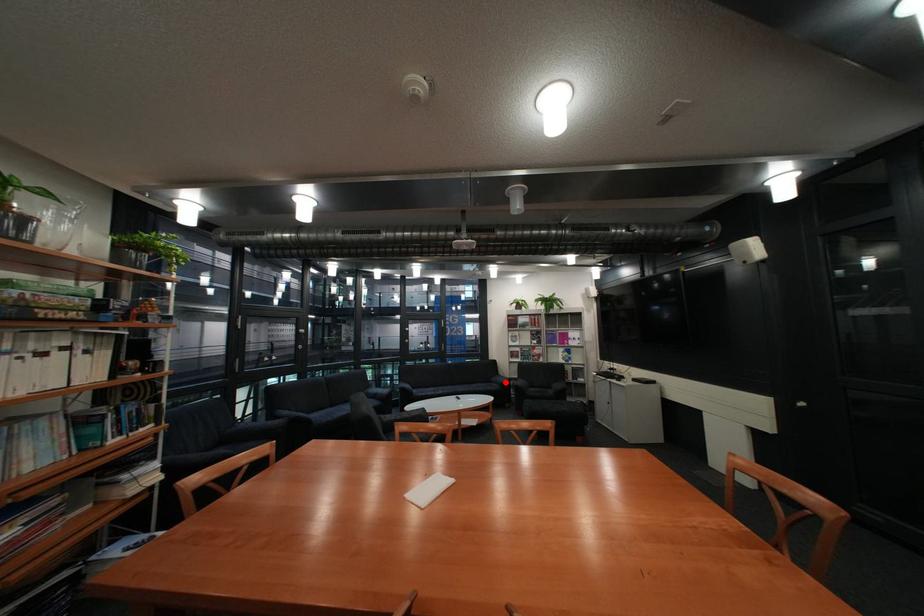
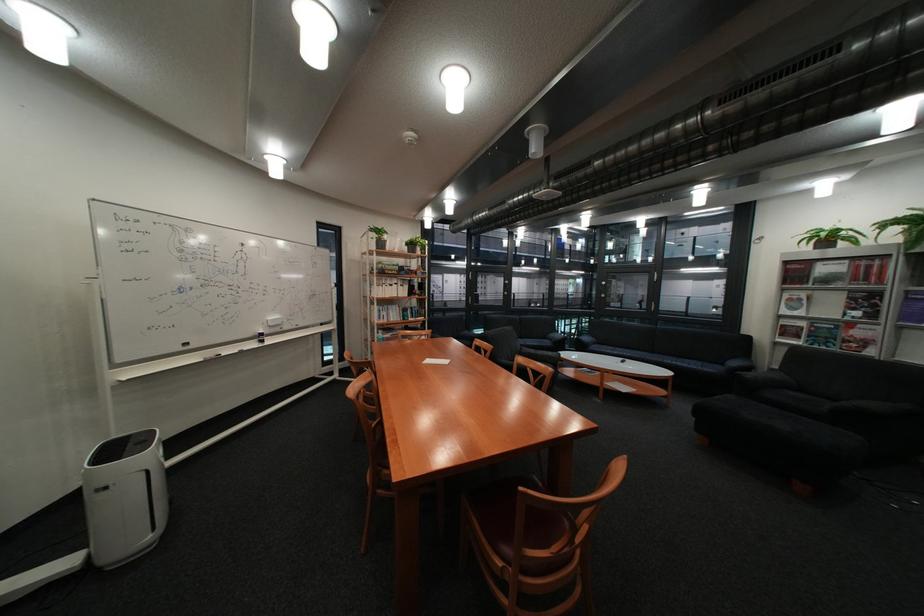
Question: I am providing you with two images of the same scene from different viewpoints. Image1 has a red point marked. In image2, the corresponding 3D location appears at what relative position? Reply with the corresponding letter.

Choices:
 (A) Closer
 (B) Farther

Answer: (A)